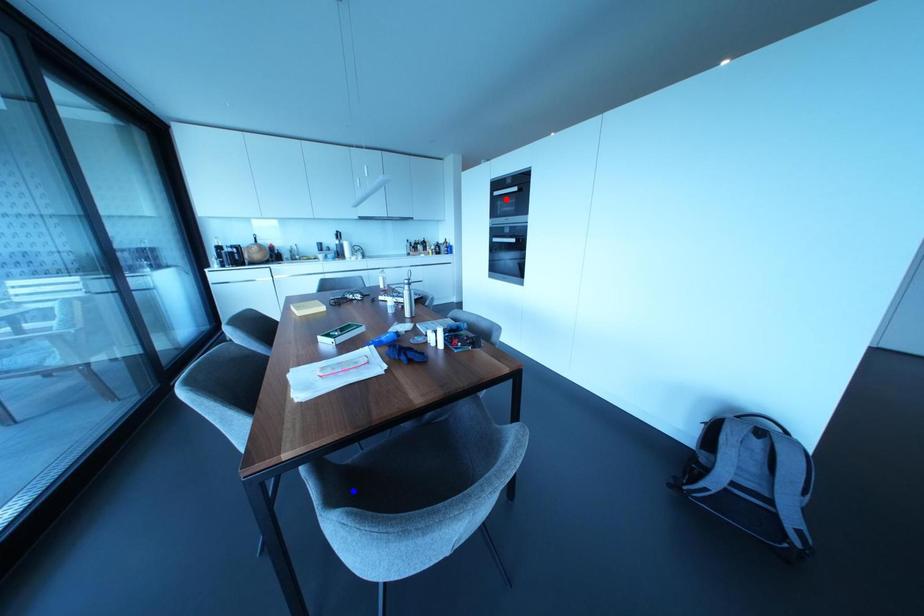
Question: Two points are marked on the image. Which point is closer to the camera?

Choices:
 (A) Blue point is closer.
 (B) Red point is closer.

Answer: (A)